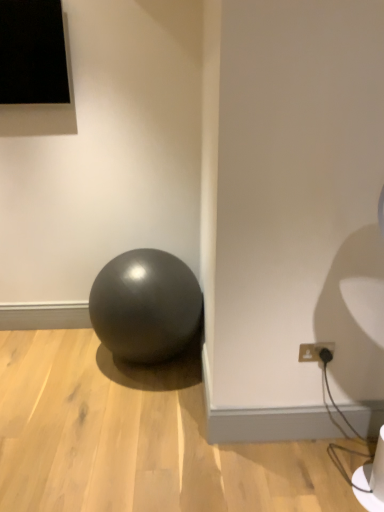
Question: In terms of height, does matte black ball at center look taller or shorter compared to matte black outlet at lower right?

Choices:
 (A) short
 (B) tall

Answer: (B)

Question: From the image's perspective, is matte black ball at center positioned above or below matte black outlet at lower right?

Choices:
 (A) below
 (B) above

Answer: (B)

Question: From a real-world perspective, is matte black ball at center physically located above or below matte black outlet at lower right?

Choices:
 (A) below
 (B) above

Answer: (A)

Question: Is point (306, 357) positioned closer to the camera than point (139, 350)?

Choices:
 (A) farther
 (B) closer

Answer: (B)

Question: Which is correct: matte black outlet at lower right is inside matte black ball at center, or outside of it?

Choices:
 (A) outside
 (B) inside

Answer: (A)

Question: From the image's perspective, is matte black outlet at lower right located above or below matte black ball at center?

Choices:
 (A) above
 (B) below

Answer: (B)

Question: From a real-world perspective, is matte black outlet at lower right physically located above or below matte black ball at center?

Choices:
 (A) above
 (B) below

Answer: (A)